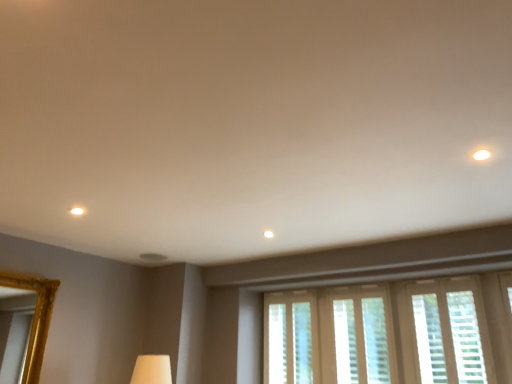
Question: Is point (270, 342) closer or farther from the camera than point (364, 352)?

Choices:
 (A) closer
 (B) farther

Answer: (B)

Question: Considering the positions of translucent plastic blinds at center, marked as the 1th window in a left-to-right arrangement, and translucent plastic blinds at lower center, the second window viewed from the right, in the image, is translucent plastic blinds at center, marked as the 1th window in a left-to-right arrangement, taller or shorter than translucent plastic blinds at lower center, the second window viewed from the right,?

Choices:
 (A) tall
 (B) short

Answer: (A)

Question: Estimate the real-world distances between objects in this image. Which object is farther from the white textured blinds at lower right, the first window positioned from the right?

Choices:
 (A) translucent plastic blinds at lower center, which appears as the 2th window when viewed from the left
 (B) translucent plastic blinds at center, marked as the 1th window in a left-to-right arrangement

Answer: (B)

Question: Estimate the real-world distances between objects in this image. Which object is closer to the translucent plastic blinds at center, marked as the 1th window in a left-to-right arrangement?

Choices:
 (A) translucent plastic blinds at lower center, which appears as the 2th window when viewed from the left
 (B) white textured blinds at lower right, the first window positioned from the right

Answer: (A)